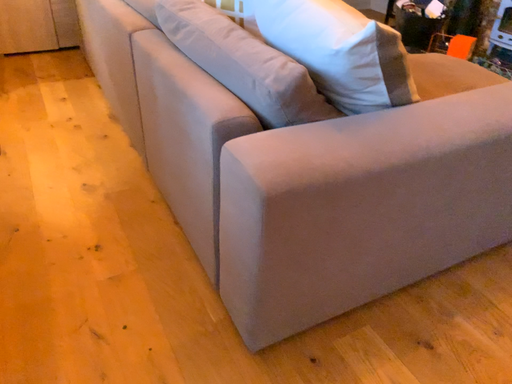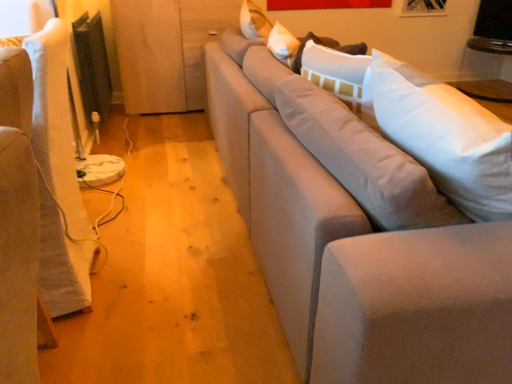
Question: Which way did the camera rotate in the video?

Choices:
 (A) rotated upward
 (B) rotated downward

Answer: (A)